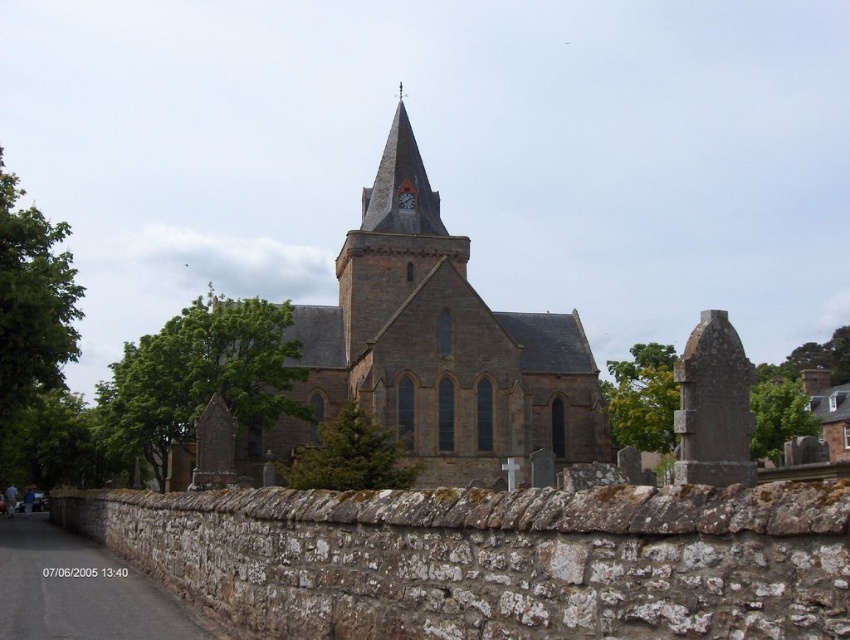
You are standing in front of the historic stone church and want to determine the relative positions of two points marked on the ground. The first point is at coordinates point (391, 228) and the second is at point (398, 196). Which point is nearer to you?

Point (391, 228) is closer to the viewer than point (398, 196).

You are standing in front of the historic stone church with a clock tower. You notice a specific point marked at coordinates (434, 348). What is the name of the object located exactly at this point?

The brown stone church at center is located at point (434, 348).

You are standing in front of the historic stone church and want to take a photo that includes both the brick steeple at center and the matte stone clock at upper center. Which object will appear larger in the photo?

The brick steeple at center will appear larger in the photo because it is taller than the matte stone clock at upper center.